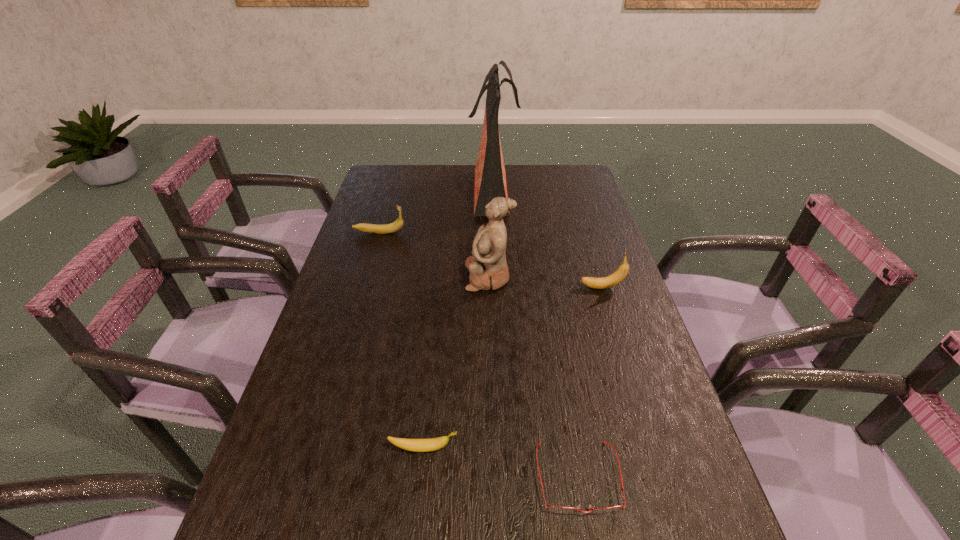
Identify the location of free space located 0.190m on the front side of the farthest object. Image resolution: width=960 pixels, height=540 pixels. (419, 189).

Identify the location of free space located on the front side of the farthest object. The width and height of the screenshot is (960, 540). (405, 189).

The width and height of the screenshot is (960, 540). Identify the location of blank space located on the front side of the farthest object. (373, 189).

Locate an element on the screen. This screenshot has height=540, width=960. free space located 0.250m on the front-facing side of the second tallest object is located at coordinates (378, 278).

The image size is (960, 540). What are the coordinates of `vacant region located 0.330m on the front-facing side of the second tallest object` in the screenshot? It's located at (351, 278).

Image resolution: width=960 pixels, height=540 pixels. What are the coordinates of `free region located on the front-facing side of the second tallest object` in the screenshot? It's located at (351, 278).

The height and width of the screenshot is (540, 960). In order to click on vacant area situated 0.400m at the start of the peel on the rightmost object in this screenshot , I will do pos(438,287).

This screenshot has width=960, height=540. I want to click on free space located at the start of the peel on the rightmost object, so click(x=477, y=287).

Identify the location of vacant region located at the start of the peel on the rightmost object. (513, 287).

Where is `free location located at the stem of the leftmost object`? Image resolution: width=960 pixels, height=540 pixels. free location located at the stem of the leftmost object is located at coordinates (512, 232).